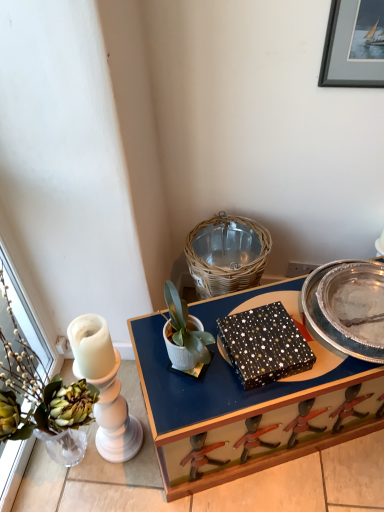
Measure the distance between white matte pot at center and camera.

A distance of 3.36 feet exists between white matte pot at center and camera.

In order to face black textured box at center, should I rotate leftwards or rightwards?

To align with it, rotate right about 9.400°.

Describe the element at coordinates (248, 412) in the screenshot. I see `matte black box at center` at that location.

Locate an element on the screen. The height and width of the screenshot is (512, 384). white matte pot at center is located at coordinates (184, 333).

Does matte black box at center have a greater height compared to black textured box at center?

Correct, matte black box at center is much taller as black textured box at center.

Does matte black box at center have a larger size compared to black textured box at center?

Indeed, matte black box at center has a larger size compared to black textured box at center.

From the image's perspective, is matte black box at center above or below black textured box at center?

matte black box at center is below black textured box at center.

How different are the orientations of matte black box at center and white matte pot at center in degrees?

0.000117 degrees separate the facing orientations of matte black box at center and white matte pot at center.

Considering the positions of objects matte black box at center and white matte pot at center in the image provided, who is more to the left, matte black box at center or white matte pot at center?

From the viewer's perspective, white matte pot at center appears more on the left side.

Between matte black box at center and white matte pot at center, which one is positioned behind?

matte black box at center is further away from the camera.

Is matte black box at center placed right next to white matte pot at center?

No, matte black box at center is not in contact with white matte pot at center.

Does matte black box at center lie in front of silver metallic picture frame at upper right?

No.

Which object is thinner, matte black box at center or silver metallic picture frame at upper right?

Thinner between the two is silver metallic picture frame at upper right.

Is point (321, 441) positioned in front of point (375, 18)?

No, (321, 441) is further to viewer.

Which is more to the right, matte black box at center or silver metallic picture frame at upper right?

silver metallic picture frame at upper right.

From their relative heights in the image, would you say silver metallic picture frame at upper right is taller or shorter than woven wicker basket at upper center?

In the image, silver metallic picture frame at upper right appears to be taller than woven wicker basket at upper center.

Does silver metallic picture frame at upper right turn towards woven wicker basket at upper center?

No, silver metallic picture frame at upper right does not turn towards woven wicker basket at upper center.

Is silver metallic picture frame at upper right thinner than woven wicker basket at upper center?

Correct, the width of silver metallic picture frame at upper right is less than that of woven wicker basket at upper center.

Can you tell me how much silver metallic picture frame at upper right and woven wicker basket at upper center differ in facing direction?

The facing directions of silver metallic picture frame at upper right and woven wicker basket at upper center are 1.01 degrees apart.

From a real-world perspective, between white matte pot at center and silver metallic picture frame at upper right, who is vertically higher?

silver metallic picture frame at upper right, from a real-world perspective.

Is white matte pot at center in front of or behind silver metallic picture frame at upper right in the image?

Clearly, white matte pot at center is in front of silver metallic picture frame at upper right.

Is there a large distance between white matte pot at center and silver metallic picture frame at upper right?

No, white matte pot at center is not far away from silver metallic picture frame at upper right.

Is silver metallic picture frame at upper right to the right of black textured box at center from the viewer's perspective?

Yes.

From the image's perspective, is silver metallic picture frame at upper right located above or below black textured box at center?

silver metallic picture frame at upper right is above black textured box at center.

From a real-world perspective, is silver metallic picture frame at upper right above or below black textured box at center?

silver metallic picture frame at upper right is situated higher than black textured box at center in the real world.

How much distance is there between silver metallic picture frame at upper right and black textured box at center?

silver metallic picture frame at upper right and black textured box at center are 28.32 inches apart from each other.

Looking at this image, can you confirm if silver metallic picture frame at upper right is bigger than white matte pot at center?

No, silver metallic picture frame at upper right is not bigger than white matte pot at center.

Is there a large distance between silver metallic picture frame at upper right and white matte pot at center?

Actually, silver metallic picture frame at upper right and white matte pot at center are a little close together.

Which object is further away from the camera taking this photo, silver metallic picture frame at upper right or white matte pot at center?

silver metallic picture frame at upper right is more distant.

From the image's perspective, which object appears higher, silver metallic picture frame at upper right or white matte pot at center?

From the image's view, silver metallic picture frame at upper right is above.

The image size is (384, 512). I want to click on desk below the black textured box at center (from the image's perspective), so click(x=248, y=412).

You are a GUI agent. You are given a task and a screenshot of the screen. Output one action in this format:
    pyautogui.click(x=<x>, y=<y>)
    Task: Click on the houseplant located above the matte black box at center (from the image's perspective)
    The height and width of the screenshot is (512, 384).
    Given the screenshot: What is the action you would take?
    pyautogui.click(x=184, y=333)

Estimate the real-world distances between objects in this image. Which object is closer to black textured box at center, silver metallic picture frame at upper right or woven wicker basket at upper center?

woven wicker basket at upper center is closer to black textured box at center.

Based on their spatial positions, is matte black box at center or woven wicker basket at upper center closer to black textured box at center?

matte black box at center lies closer to black textured box at center than the other object.

Looking at the image, which one is located further to woven wicker basket at upper center, matte black box at center or silver metallic tray at center-right?

matte black box at center.

From the image, which object appears to be nearer to white matte pot at center, black textured box at center or woven wicker basket at upper center?

The object closer to white matte pot at center is black textured box at center.

Looking at the image, which one is located closer to woven wicker basket at upper center, silver metallic tray at center-right or white matte pot at center?

silver metallic tray at center-right is closer to woven wicker basket at upper center.

Looking at the image, which one is located further to black textured box at center, matte black box at center or white matte pot at center?

matte black box at center.

When comparing their distances from matte black box at center, does black textured box at center or woven wicker basket at upper center seem closer?

black textured box at center is positioned closer to the anchor matte black box at center.

Based on the photo, looking at the image, which one is located closer to woven wicker basket at upper center, black textured box at center or white matte pot at center?

black textured box at center is closer to woven wicker basket at upper center.

Image resolution: width=384 pixels, height=512 pixels. I want to click on basket between silver metallic picture frame at upper right and black textured box at center from top to bottom, so click(226, 254).

Identify the location of desk between woven wicker basket at upper center and silver metallic tray at center-right from left to right. (248, 412).

At what (x,y) coordinates should I click in order to perform the action: click on glass plate situated between white matte pot at center and silver metallic tray at center-right from left to right. Please return your answer as a coordinate pair (x, y). Looking at the image, I should click on (299, 329).

Identify the location of glass plate situated between white matte pot at center and matte black box at center from left to right. The image size is (384, 512). (299, 329).